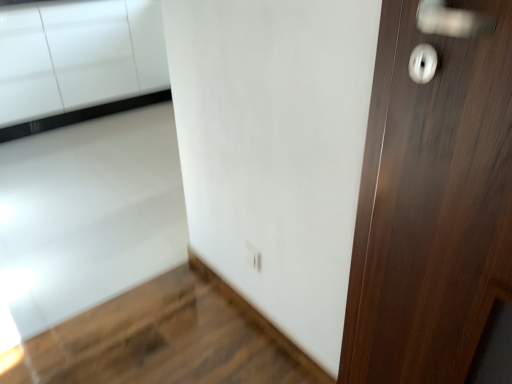
Question: Relative to dark wood door at right, is white glossy electric outlet at lower center in front or behind?

Choices:
 (A) front
 (B) behind

Answer: (B)

Question: Considering the positions of white glossy electric outlet at lower center and dark wood door at right in the image, is white glossy electric outlet at lower center bigger or smaller than dark wood door at right?

Choices:
 (A) big
 (B) small

Answer: (B)

Question: Which object is positioned closest to the dark wood door at right?

Choices:
 (A) white glossy cabinetry at lower left
 (B) white glossy electric outlet at lower center

Answer: (B)

Question: Which is farther from the white glossy electric outlet at lower center?

Choices:
 (A) dark wood door at right
 (B) white glossy cabinetry at lower left

Answer: (B)